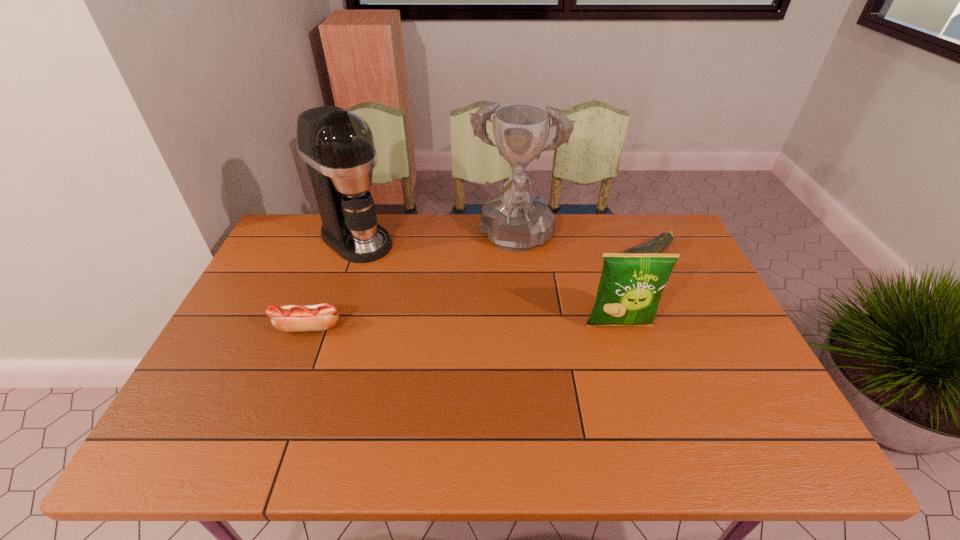
Locate an element on the screen. vacant space on the desktop that is between the sausage and the crisp (potato chip) and is positioned place cup under the spout of the coffee maker is located at coordinates (467, 326).

The width and height of the screenshot is (960, 540). Identify the location of vacant space on the desktop that is between the sausage and the crisp (potato chip) and is positioned at the blossom end of the zucchini. (507, 326).

This screenshot has width=960, height=540. In order to click on vacant spot on the desktop that is between the sausage and the crisp (potato chip) and is positioned on the side with emblem of the award in this screenshot , I will do coord(496,326).